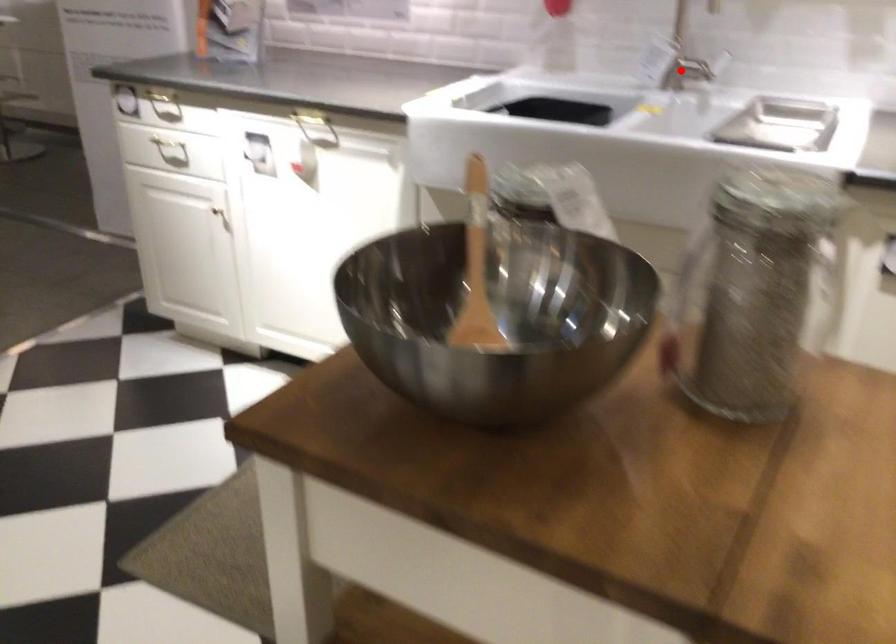
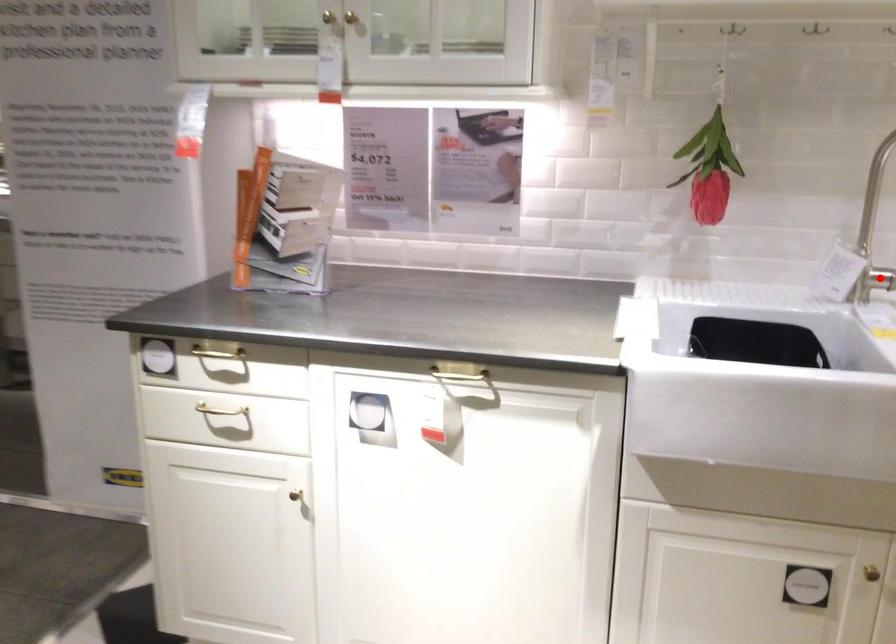
I am providing you with two images of the same scene from different viewpoints. A red point is marked on the first image and another point is marked on the second image. Is the red point in image1 aligned with the point shown in image2?

Yes